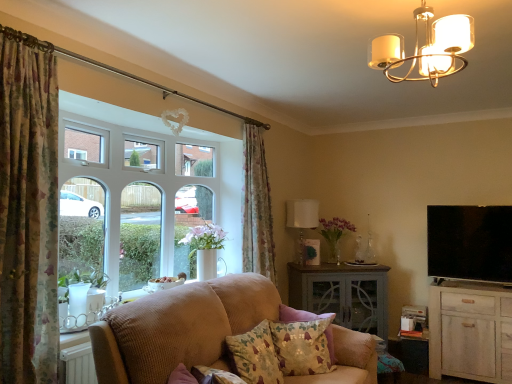
Question: Can you see white fabric lampshade at center, the 2th lamp in the top-to-bottom sequence, touching flat screen tv at right?

Choices:
 (A) no
 (B) yes

Answer: (A)

Question: Is white fabric lampshade at center, placed as the second lamp when sorted from front to back, to the left of flat screen tv at right from the viewer's perspective?

Choices:
 (A) no
 (B) yes

Answer: (B)

Question: From a real-world perspective, is white fabric lampshade at center, arranged as the first lamp when viewed from the back, positioned over flat screen tv at right based on gravity?

Choices:
 (A) yes
 (B) no

Answer: (A)

Question: Is white fabric lampshade at center, placed as the second lamp when sorted from front to back, further to the viewer compared to flat screen tv at right?

Choices:
 (A) no
 (B) yes

Answer: (B)

Question: From the image's perspective, is white fabric lampshade at center, placed as the second lamp when sorted from front to back, beneath flat screen tv at right?

Choices:
 (A) yes
 (B) no

Answer: (B)

Question: Is white fabric lampshade at center, arranged as the first lamp when viewed from the back, taller than flat screen tv at right?

Choices:
 (A) yes
 (B) no

Answer: (B)

Question: Is the surface of gray painted cabinet at center, the 1th table when ordered from left to right, in direct contact with white fabric lampshade at center, the 2th lamp in the top-to-bottom sequence?

Choices:
 (A) no
 (B) yes

Answer: (A)

Question: Is gray painted cabinet at center, the 1th table when ordered from left to right, to the right of white fabric lampshade at center, the 2th lamp in the top-to-bottom sequence, from the viewer's perspective?

Choices:
 (A) no
 (B) yes

Answer: (B)

Question: Can you confirm if gray painted cabinet at center, the 1th table when ordered from left to right, is positioned to the left of white fabric lampshade at center, which is the 1th lamp from bottom to top?

Choices:
 (A) yes
 (B) no

Answer: (B)

Question: Could you tell me if gray painted cabinet at center, the second table in the right-to-left sequence, is facing white fabric lampshade at center, the 2th lamp in the top-to-bottom sequence?

Choices:
 (A) no
 (B) yes

Answer: (A)

Question: Can you confirm if gray painted cabinet at center, the second table in the right-to-left sequence, is thinner than white fabric lampshade at center, arranged as the first lamp when viewed from the back?

Choices:
 (A) yes
 (B) no

Answer: (B)

Question: From the image's perspective, does gray painted cabinet at center, the 1th table when ordered from left to right, appear higher than white fabric lampshade at center, arranged as the first lamp when viewed from the back?

Choices:
 (A) no
 (B) yes

Answer: (A)

Question: Is floral fabric cushion at lower center, the second pillow from the front, positioned far away from white wood cabinet at lower right?

Choices:
 (A) no
 (B) yes

Answer: (B)